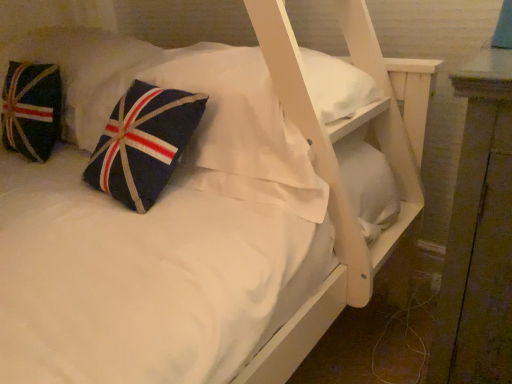
What do you see at coordinates (84, 72) in the screenshot? I see `navy blue fabric pillow at upper left` at bounding box center [84, 72].

This screenshot has width=512, height=384. In order to click on navy blue fabric pillow at upper left in this screenshot , I will do `click(84, 72)`.

The height and width of the screenshot is (384, 512). Find the location of `navy blue fabric pillow at upper left`. navy blue fabric pillow at upper left is located at coordinates (84, 72).